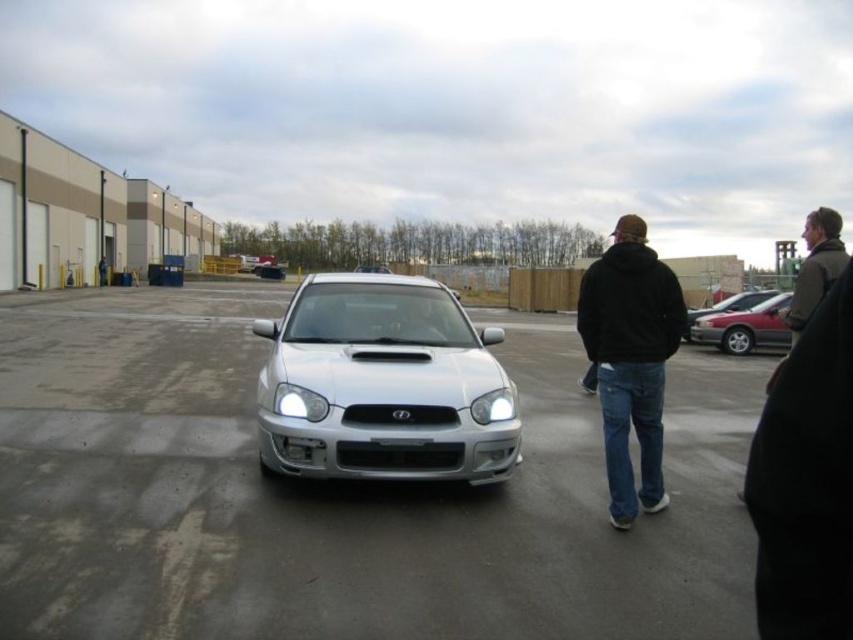
Is silver metallic car at center wider than metallic silver sedan at right?

Indeed, silver metallic car at center has a greater width compared to metallic silver sedan at right.

Image resolution: width=853 pixels, height=640 pixels. I want to click on silver metallic car at center, so click(338, 493).

Does black fleece jacket at center have a lesser width compared to white plastic license plate at center?

No.

Describe the element at coordinates (630, 358) in the screenshot. I see `black fleece jacket at center` at that location.

At what (x,y) coordinates should I click in order to perform the action: click on black fleece jacket at center. Please return your answer as a coordinate pair (x, y). Image resolution: width=853 pixels, height=640 pixels. Looking at the image, I should click on (630, 358).

Find the location of `black fleece jacket at center`. black fleece jacket at center is located at coordinates (630, 358).

Which is more to the right, silver metallic car at center or white plastic license plate at center?

From the viewer's perspective, white plastic license plate at center appears more on the right side.

Is silver metallic car at center positioned before white plastic license plate at center?

Yes, silver metallic car at center is closer to the viewer.

Is point (265, 632) positioned behind point (412, 444)?

No, it is in front of (412, 444).

Locate an element on the screen. The width and height of the screenshot is (853, 640). silver metallic car at center is located at coordinates (338, 493).